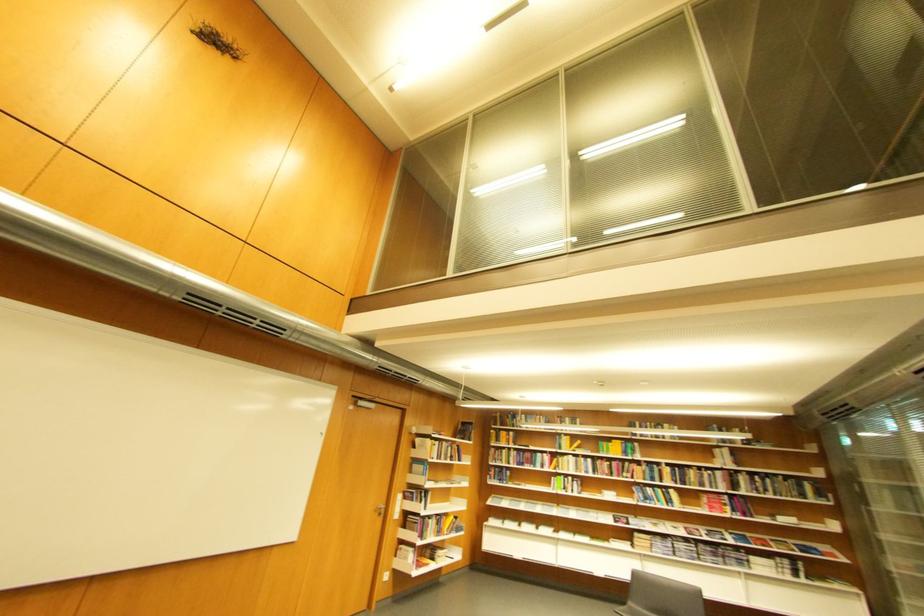
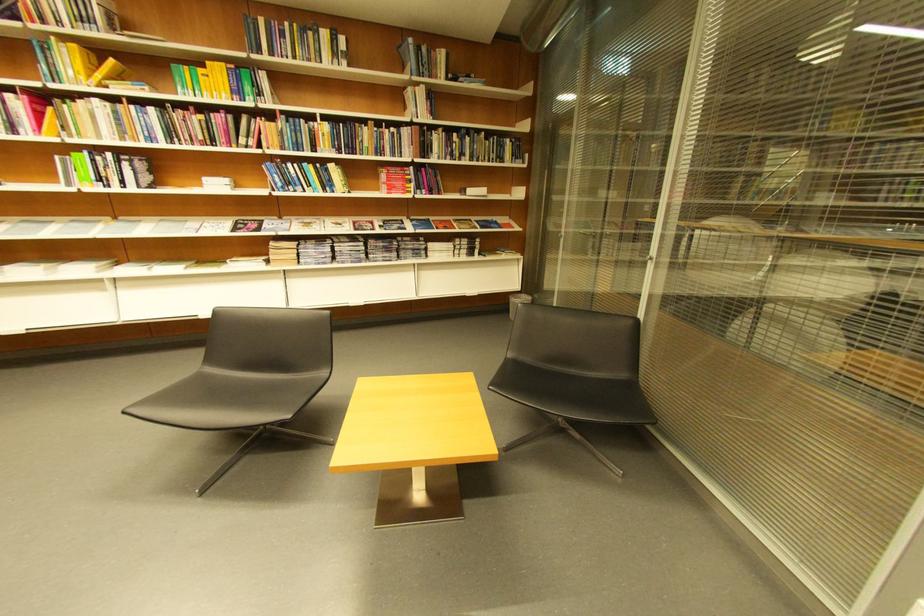
In the second image, find the point that corresponds to the point at 580,458 in the first image.

(106, 102)